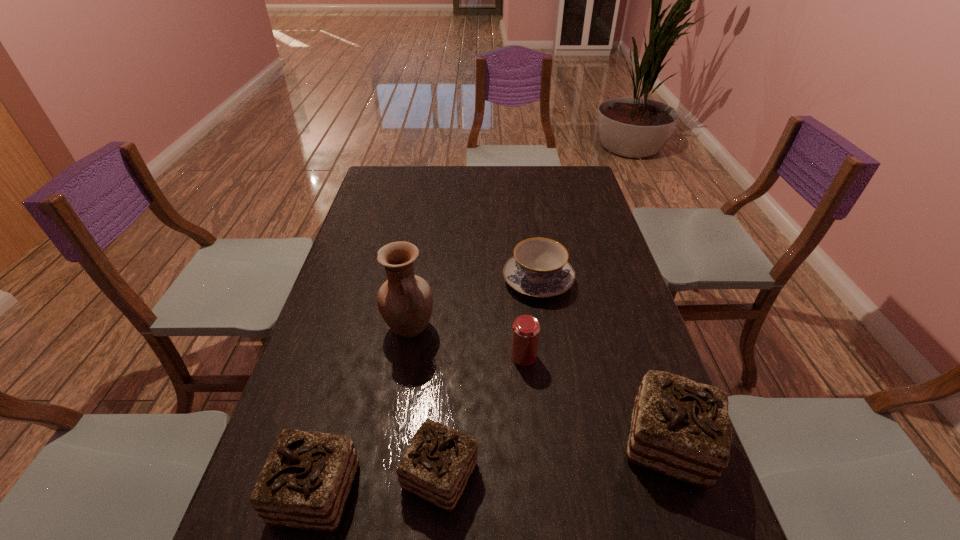
If equal spacing is desired by inserting an extra chocolate_cake among them, please point out a free spot for this new chocolate_cake. Please provide its 2D coordinates. Your answer should be formatted as a tuple, i.e. [(x, y)], where the tuple contains the x and y coordinates of a point satisfying the conditions above.

[(558, 458)]